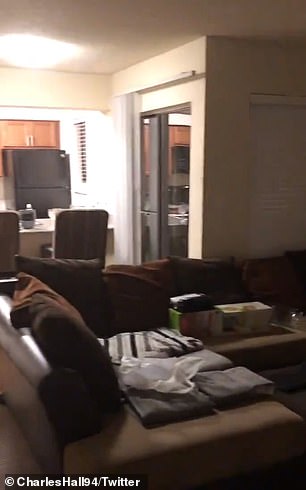
Find the location of a particular element. Image resolution: width=306 pixels, height=490 pixels. kitchen chair is located at coordinates (7, 234), (83, 231).